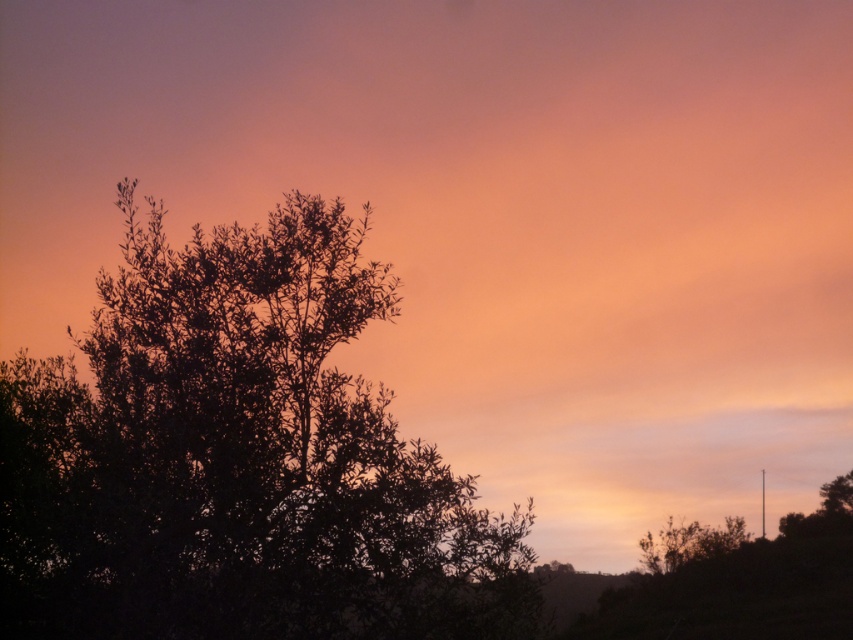
Question: Is dark green leafy tree at left to the left of green leafy bush at lower right from the viewer's perspective?

Choices:
 (A) yes
 (B) no

Answer: (A)

Question: Which object appears closest to the camera in this image?

Choices:
 (A) green leafy bush at lower right
 (B) dark green leafy tree at left

Answer: (B)

Question: Which object appears closest to the camera in this image?

Choices:
 (A) green leafy bush at lower right
 (B) dark green leafy tree at left

Answer: (B)

Question: Does dark green leafy tree at left appear on the right side of green leafy bush at lower right?

Choices:
 (A) yes
 (B) no

Answer: (B)

Question: Can you confirm if dark green leafy tree at left is smaller than green leafy bush at lower right?

Choices:
 (A) yes
 (B) no

Answer: (B)

Question: Which point is closer to the camera?

Choices:
 (A) dark green leafy tree at left
 (B) green leafy bush at lower right

Answer: (A)